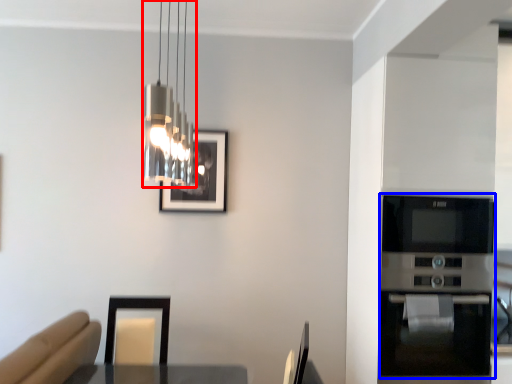
Question: Which object is closer to the camera taking this photo, lamp (highlighted by a red box) or appliance (highlighted by a blue box)?

Choices:
 (A) lamp
 (B) appliance

Answer: (A)